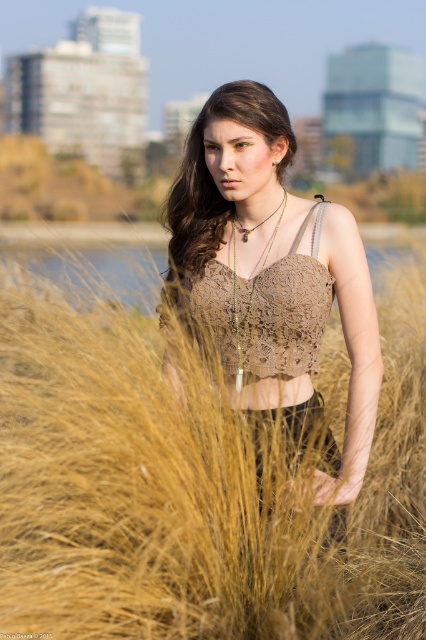
Question: From the image, what is the correct spatial relationship of brown textured reed at center in relation to brown lace crop top at center?

Choices:
 (A) left
 (B) right

Answer: (A)

Question: Does brown textured reed at center appear on the right side of lace fabric bikini top at center?

Choices:
 (A) no
 (B) yes

Answer: (A)

Question: Which object appears farthest from the camera in this image?

Choices:
 (A) brown lace crop top at center
 (B) brown textured reed at center

Answer: (A)

Question: Which point is closer to the camera?

Choices:
 (A) brown lace top at center
 (B) lace fabric bikini top at center
 (C) brown textured reed at center

Answer: (C)

Question: Is brown lace crop top at center positioned at the back of brown lace top at center?

Choices:
 (A) no
 (B) yes

Answer: (A)

Question: Which of the following is the farthest from the observer?

Choices:
 (A) (331, 284)
 (B) (183, 164)
 (C) (262, 554)

Answer: (B)